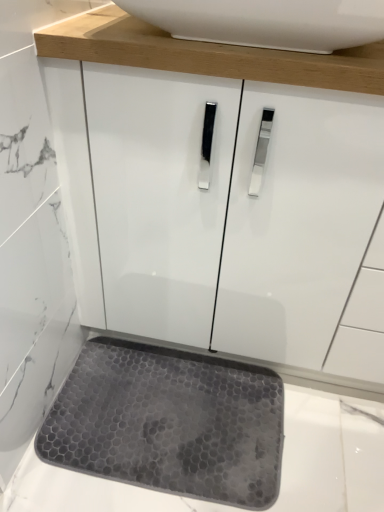
Identify the location of white glossy sink at upper center. (267, 22).

This screenshot has width=384, height=512. What do you see at coordinates (267, 22) in the screenshot?
I see `white glossy sink at upper center` at bounding box center [267, 22].

The image size is (384, 512). Describe the element at coordinates (169, 422) in the screenshot. I see `gray rubber mat at lower center` at that location.

Measure the distance between gray rubber mat at lower center and camera.

The depth of gray rubber mat at lower center is 36.93 inches.

Find the location of a particular element. The width and height of the screenshot is (384, 512). gray rubber mat at lower center is located at coordinates (169, 422).

Find the location of `white glossy sink at upper center`. white glossy sink at upper center is located at coordinates (267, 22).

Considering the positions of objects white glossy sink at upper center and gray rubber mat at lower center in the image provided, who is more to the left, white glossy sink at upper center or gray rubber mat at lower center?

gray rubber mat at lower center.

Is white glossy sink at upper center further to the viewer compared to gray rubber mat at lower center?

No, white glossy sink at upper center is in front of gray rubber mat at lower center.

Considering the points (368, 29) and (139, 360), which point is behind, point (368, 29) or point (139, 360)?

The point (139, 360) is behind.

From the image's perspective, is white glossy sink at upper center located beneath gray rubber mat at lower center?

Incorrect, from the image's perspective, white glossy sink at upper center is higher than gray rubber mat at lower center.

From a real-world perspective, is white glossy sink at upper center physically above gray rubber mat at lower center?

Yes, from a real-world perspective, white glossy sink at upper center is above gray rubber mat at lower center.

Considering the relative sizes of white glossy sink at upper center and gray rubber mat at lower center in the image provided, is white glossy sink at upper center wider than gray rubber mat at lower center?

No, white glossy sink at upper center is not wider than gray rubber mat at lower center.

Considering the relative sizes of white glossy sink at upper center and gray rubber mat at lower center in the image provided, is white glossy sink at upper center taller than gray rubber mat at lower center?

Correct, white glossy sink at upper center is much taller as gray rubber mat at lower center.

Is white glossy sink at upper center smaller than gray rubber mat at lower center?

Incorrect, white glossy sink at upper center is not smaller in size than gray rubber mat at lower center.

Is white glossy sink at upper center inside the boundaries of gray rubber mat at lower center, or outside?

white glossy sink at upper center is located beyond the bounds of gray rubber mat at lower center.

Is white glossy sink at upper center next to gray rubber mat at lower center?

No, white glossy sink at upper center is not with gray rubber mat at lower center.

Is white glossy sink at upper center looking in the opposite direction of gray rubber mat at lower center?

No, white glossy sink at upper center is not facing the opposite direction of gray rubber mat at lower center.

Identify the location of sink above the gray rubber mat at lower center (from the image's perspective). (267, 22).

In the scene shown: Considering the relative positions of gray rubber mat at lower center and white glossy sink at upper center in the image provided, is gray rubber mat at lower center to the left or to the right of white glossy sink at upper center?

In the image, gray rubber mat at lower center appears on the left side of white glossy sink at upper center.

Who is more distant, gray rubber mat at lower center or white glossy sink at upper center?

gray rubber mat at lower center.

Is point (214, 453) less distant than point (355, 39)?

No, it is behind (355, 39).

From the image's perspective, which is below, gray rubber mat at lower center or white glossy sink at upper center?

gray rubber mat at lower center, from the image's perspective.

From a real-world perspective, who is located lower, gray rubber mat at lower center or white glossy sink at upper center?

gray rubber mat at lower center.

Looking at this image, which of these two, gray rubber mat at lower center or white glossy sink at upper center, is wider?

gray rubber mat at lower center is wider.

Between gray rubber mat at lower center and white glossy sink at upper center, which one has less height?

gray rubber mat at lower center is shorter.

Between gray rubber mat at lower center and white glossy sink at upper center, which one has smaller size?

gray rubber mat at lower center.

Can white glossy sink at upper center be found inside gray rubber mat at lower center?

No.

Is gray rubber mat at lower center next to white glossy sink at upper center and touching it?

No, gray rubber mat at lower center is not beside white glossy sink at upper center.

Is gray rubber mat at lower center aimed at white glossy sink at upper center?

No, gray rubber mat at lower center is not aimed at white glossy sink at upper center.

Looking at this image, can you tell me how much gray rubber mat at lower center and white glossy sink at upper center differ in facing direction?

The facing directions of gray rubber mat at lower center and white glossy sink at upper center are 0.3 degrees apart.

Locate an element on the screen. mat below the white glossy sink at upper center (from a real-world perspective) is located at coordinates (169, 422).

The image size is (384, 512). I want to click on mat on the left of white glossy sink at upper center, so click(x=169, y=422).

Image resolution: width=384 pixels, height=512 pixels. Identify the location of mat below the white glossy sink at upper center (from the image's perspective). (169, 422).